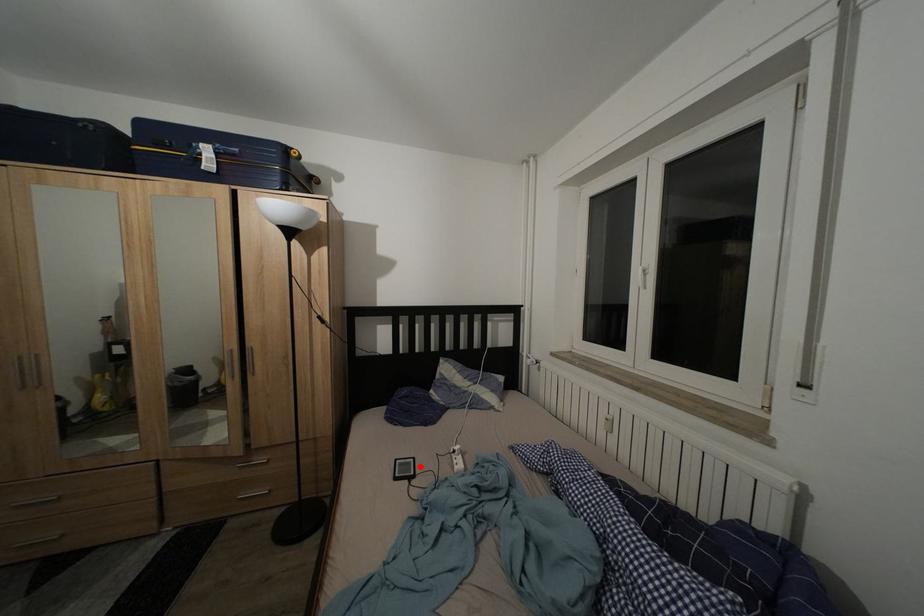
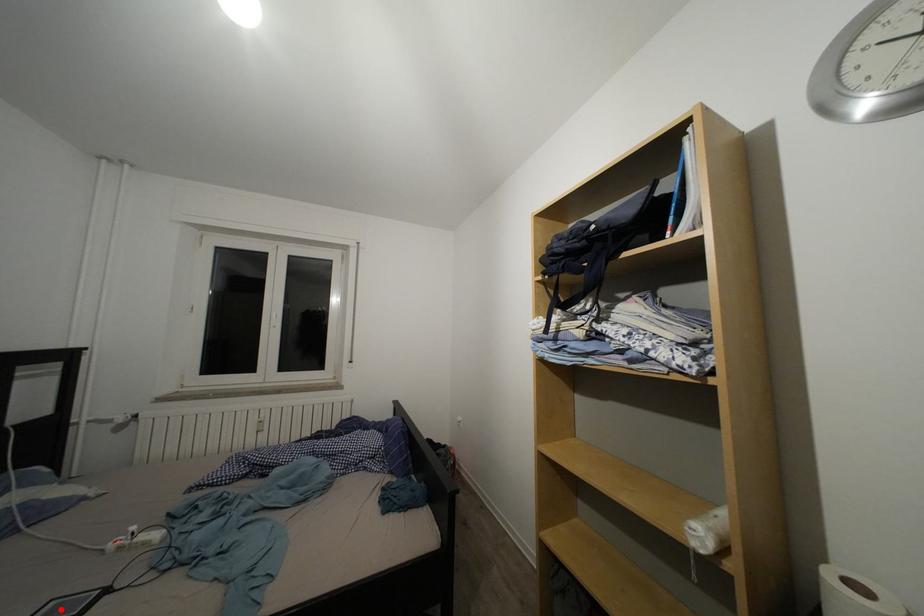
I am providing you with two images of the same scene from different viewpoints. A red point is marked on the first image and another point is marked on the second image. Are the points marked in image1 and image2 representing the same 3D position?

Yes